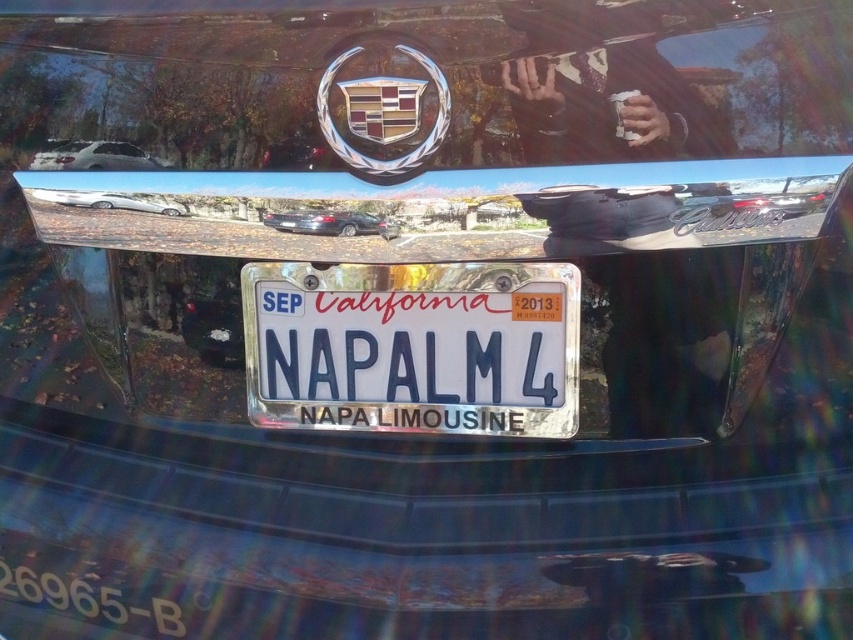
Is the position of shiny black sedan at center more distant than that of silver metallic car at upper left?

No, shiny black sedan at center is in front of silver metallic car at upper left.

Between shiny black sedan at center and silver metallic car at upper left, which one has less height?

shiny black sedan at center is shorter.

What do you see at coordinates (331, 221) in the screenshot?
I see `shiny black sedan at center` at bounding box center [331, 221].

Image resolution: width=853 pixels, height=640 pixels. I want to click on shiny black sedan at center, so (331, 221).

Does white glossy sedan at upper left appear on the left side of silver metallic car at upper left?

Indeed, white glossy sedan at upper left is positioned on the left side of silver metallic car at upper left.

Does white glossy sedan at upper left lie in front of silver metallic car at upper left?

No, it is behind silver metallic car at upper left.

Locate an element on the screen. The height and width of the screenshot is (640, 853). white glossy sedan at upper left is located at coordinates (96, 156).

Does white glossy sedan at upper left appear on the left side of shiny black sedan at center?

Yes, white glossy sedan at upper left is to the left of shiny black sedan at center.

Is white glossy sedan at upper left in front of shiny black sedan at center?

No, it is behind shiny black sedan at center.

Find the location of a particular element. The width and height of the screenshot is (853, 640). white glossy sedan at upper left is located at coordinates click(96, 156).